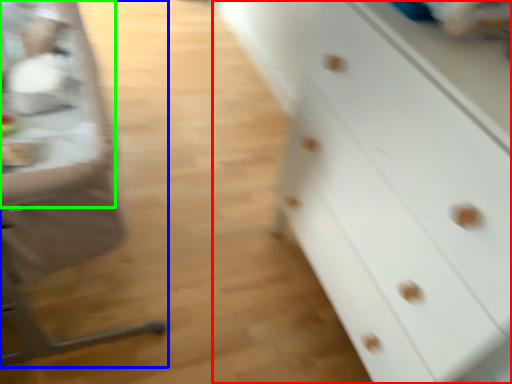
Question: Considering the real-world distances, which object is closest to chest of drawers (highlighted by a red box)? feeding chair (highlighted by a blue box) or table (highlighted by a green box).

Choices:
 (A) feeding chair
 (B) table

Answer: (A)